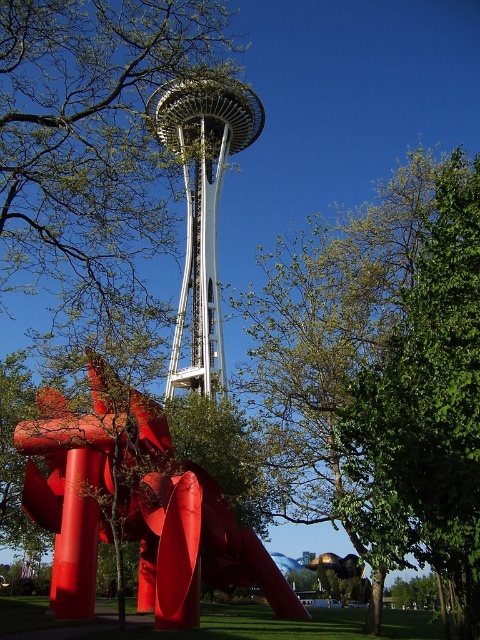
Question: Considering the relative positions of green leafy tree at center and white metallic space needle at center in the image provided, where is green leafy tree at center located with respect to white metallic space needle at center?

Choices:
 (A) left
 (B) right

Answer: (B)

Question: Which object is farther from the camera taking this photo?

Choices:
 (A) white metallic space needle at center
 (B) green leafy tree at center

Answer: (A)

Question: Considering the relative positions of glossy red sculpture at lower left and white metallic space needle at center in the image provided, where is glossy red sculpture at lower left located with respect to white metallic space needle at center?

Choices:
 (A) below
 (B) above

Answer: (A)

Question: Can you confirm if green leafy tree at center is positioned to the right of white metallic space needle at center?

Choices:
 (A) yes
 (B) no

Answer: (A)

Question: Which of the following is the farthest from the observer?

Choices:
 (A) white metallic space needle at center
 (B) glossy red sculpture at lower left

Answer: (A)

Question: Among these objects, which one is farthest from the camera?

Choices:
 (A) white metallic space needle at center
 (B) green leafy tree at center
 (C) glossy red sculpture at lower left

Answer: (A)